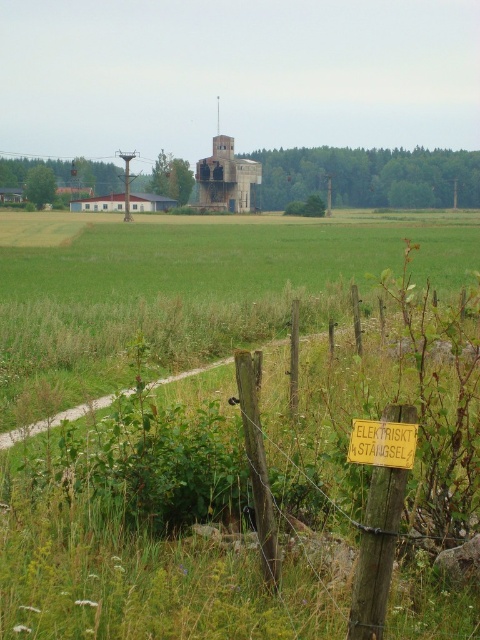
Question: Can you confirm if rustic concrete silo at center is wider than yellow wood sign at lower center?

Choices:
 (A) yes
 (B) no

Answer: (A)

Question: Estimate the real-world distances between objects in this image. Which object is farther from the yellow wood sign at lower center?

Choices:
 (A) rustic concrete silo at center
 (B) wooden post at lower right

Answer: (A)

Question: Does wooden post at lower right have a larger size compared to yellow wood sign at lower center?

Choices:
 (A) yes
 (B) no

Answer: (A)

Question: In this image, where is rustic concrete silo at center located relative to yellow wood sign at lower center?

Choices:
 (A) left
 (B) right

Answer: (A)

Question: Which object is positioned farthest from the rustic concrete silo at center?

Choices:
 (A) yellow wood sign at lower center
 (B) wooden post at lower right

Answer: (B)

Question: Which point is closer to the camera?

Choices:
 (A) yellow wood sign at lower center
 (B) wooden post at lower right

Answer: (A)